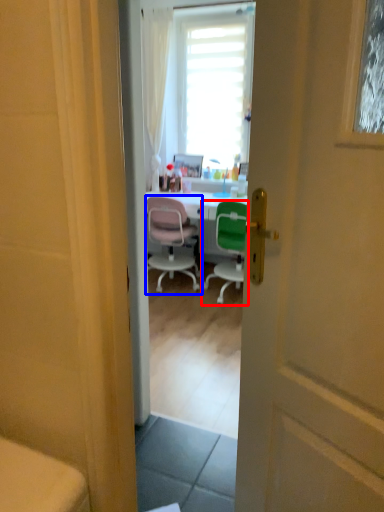
Question: Which of the following is the closest to the observer, chair (highlighted by a red box) or chair (highlighted by a blue box)?

Choices:
 (A) chair
 (B) chair

Answer: (A)